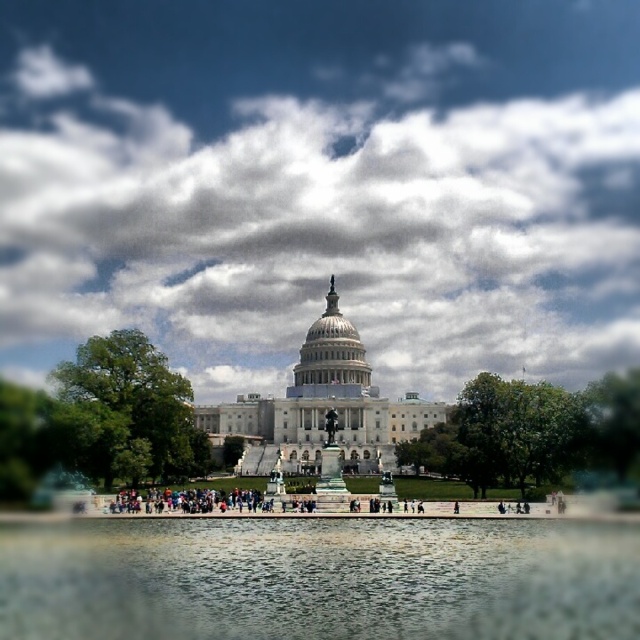
Question: Can you confirm if white fluffy cloud at center is bigger than clear glass water at center?

Choices:
 (A) no
 (B) yes

Answer: (B)

Question: Which point is farther from the camera taking this photo?

Choices:
 (A) (196, 570)
 (B) (388, 298)

Answer: (B)

Question: Can you confirm if white fluffy cloud at center is smaller than clear glass water at center?

Choices:
 (A) yes
 (B) no

Answer: (B)

Question: Can you confirm if white fluffy cloud at center is positioned to the left of clear glass water at center?

Choices:
 (A) no
 (B) yes

Answer: (B)

Question: Which point is farther to the camera?

Choices:
 (A) (596, 129)
 (B) (468, 625)

Answer: (A)